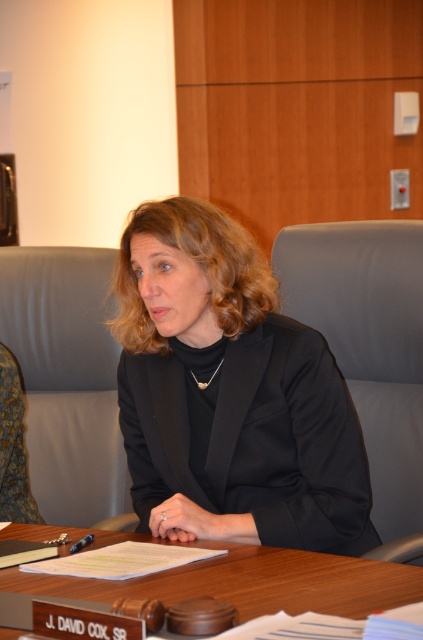
You are a photographer setting up for a professional portrait. You need to ensure that the black matte blazer at center and the wooden table at center are both in focus. Given that the depth of field can only accommodate one of them clearly, which object should you prioritize focusing on to ensure the subject of the photo is sharp?

The black matte blazer at center is bigger than the wooden table at center, so you should prioritize focusing on the black matte blazer at center to ensure the subject of the photo is sharp.